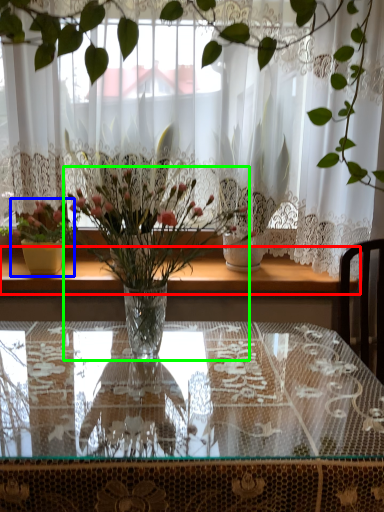
Question: Based on their relative distances, which object is nearer to window sill (highlighted by a red box)? Choose from houseplant (highlighted by a blue box) and houseplant (highlighted by a green box).

Choices:
 (A) houseplant
 (B) houseplant

Answer: (A)